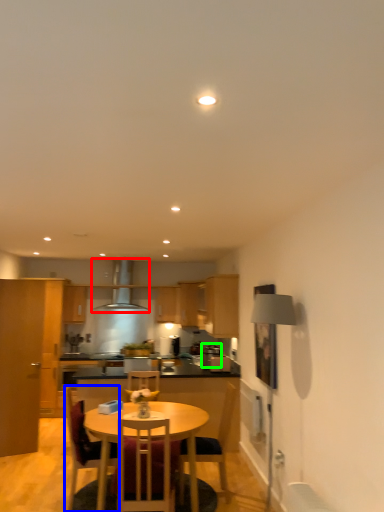
Question: Which is farther away from exhaust hood (highlighted by a red box)? chair (highlighted by a blue box) or appliance (highlighted by a green box)?

Choices:
 (A) chair
 (B) appliance

Answer: (A)